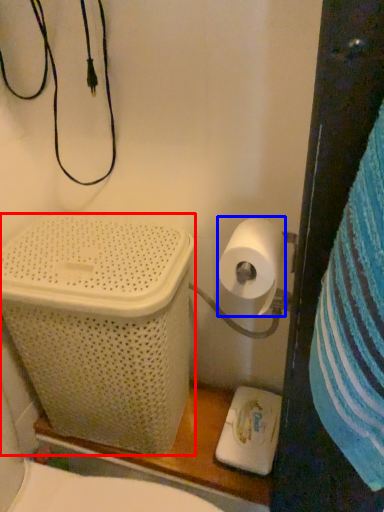
Question: Which of the following is the farthest to the observer, laundry basket (highlighted by a red box) or toilet paper (highlighted by a blue box)?

Choices:
 (A) laundry basket
 (B) toilet paper

Answer: (A)